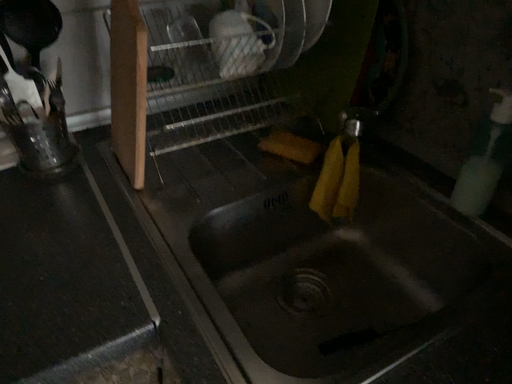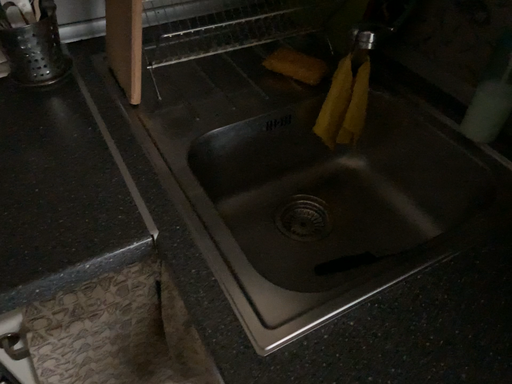
Question: How did the camera likely rotate when shooting the video?

Choices:
 (A) rotated upward
 (B) rotated downward

Answer: (B)